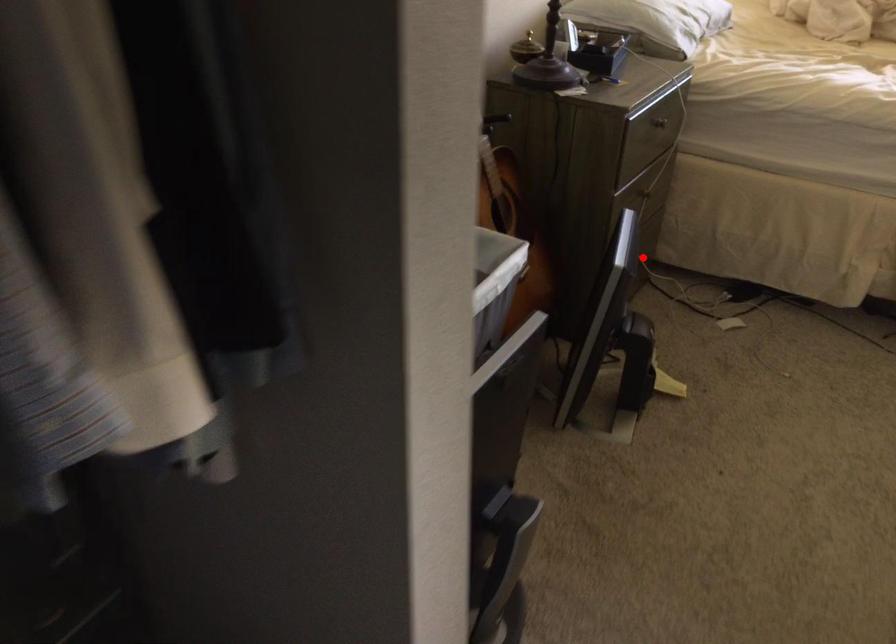
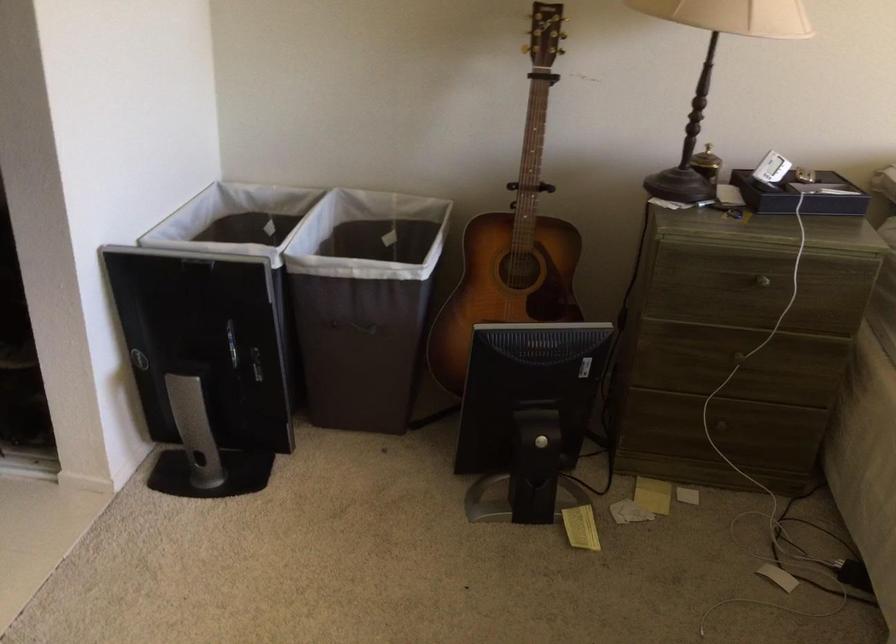
Find the pixel in the second image that matches the highlighted location in the first image.

(718, 427)